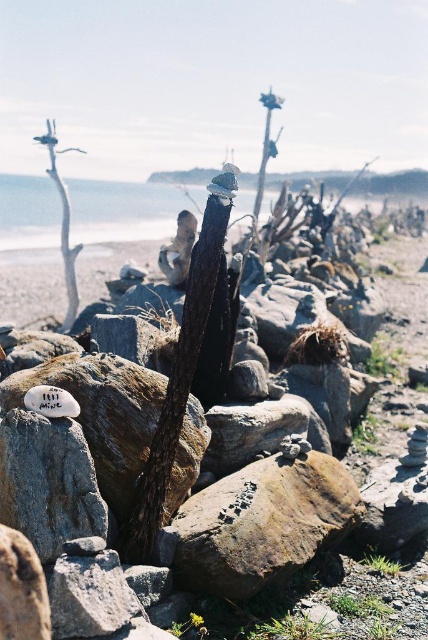
You are standing at the center of the coastal scene and want to reach both the point at coordinates point (64, 232) and point (261, 100). Which point should you head towards first to minimize the total distance walked?

You should head towards point (64, 232) first because it is closer to you than point (261, 100). After reaching the closer point, you can then proceed to the farther one, resulting in a shorter total distance walked.

You are a landscape architect designing a new garden exhibit. You have to place the rough textured rock at center and the smooth bark tree trunk at center in a way that maintains their natural arrangement. Given their sizes, which object should you place first to ensure proper spacing?

The rough textured rock at center occupies less space than the smooth bark tree trunk at center, so you should place the smooth bark tree trunk at center first to ensure there is enough space for both objects in the arrangement.

You are a visitor at this coastal area and want to place a small souvenir between the rough textured rock at center and the smooth bark tree trunk at center. According to their positions, which object should you place it closer to if you want it to be on the right side?

The rough textured rock at center is positioned on the left side of smooth bark tree trunk at center, so to place the souvenir on the right side, you should place it closer to the smooth bark tree trunk at center.